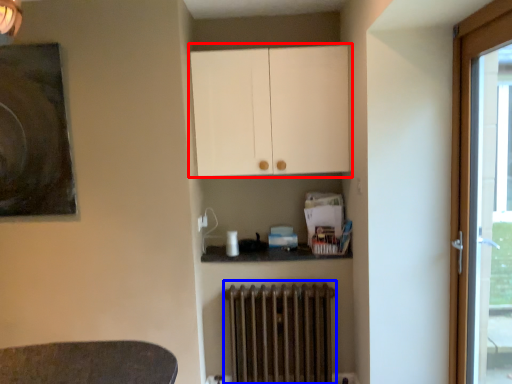
Question: Which of the following is the farthest to the observer, cabinetry (highlighted by a red box) or radiator (highlighted by a blue box)?

Choices:
 (A) cabinetry
 (B) radiator

Answer: (B)